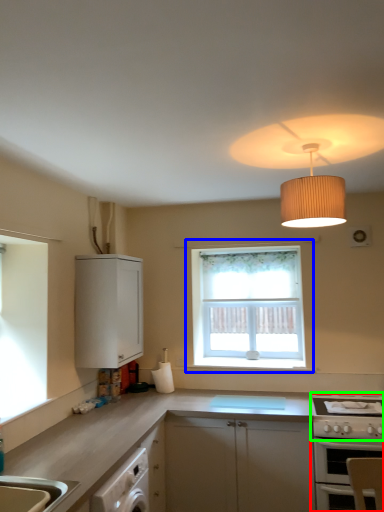
Question: Which is farther away from oven (highlighted by a red box)? window (highlighted by a blue box) or gas stove (highlighted by a green box)?

Choices:
 (A) window
 (B) gas stove

Answer: (A)